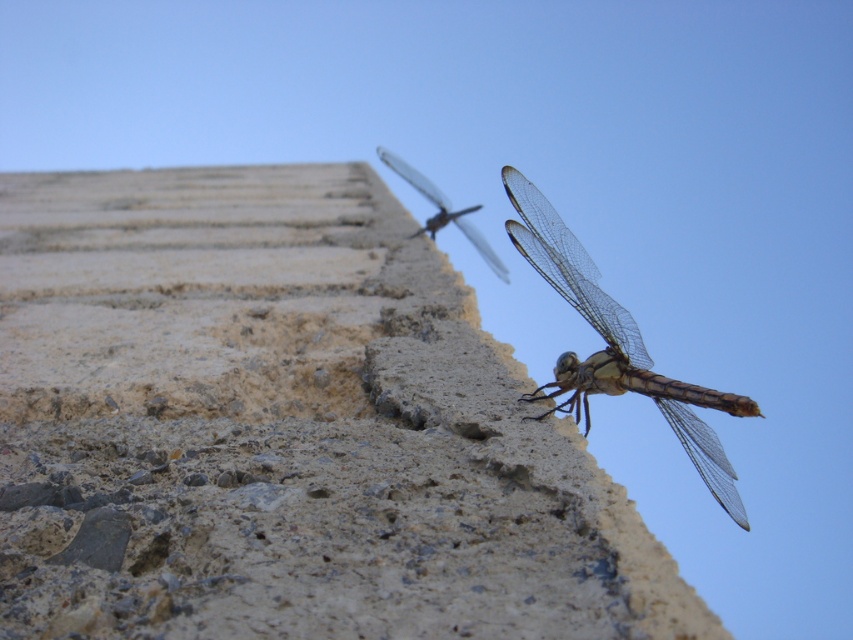
You are an entomologist examining the scene. You need to determine which object occupies more space in the image. Based on the description, which is larger in size between the rough concrete wall at center and the translucent brown dragonfly at upper right?

The rough concrete wall at center has a larger size compared to the translucent brown dragonfly at upper right, so the rough concrete wall at center occupies more space in the image.

You are a photographer trying to capture both the translucent brown dragonfly at upper right and the translucent winged insect at upper center in the same frame. Given that your camera lens has a maximum focus range of 1.2 meters, will you be able to capture both subjects clearly?

The translucent brown dragonfly at upper right and the translucent winged insect at upper center are 1.18 meters apart, so yes, the camera lens can capture both subjects clearly within its maximum focus range of 1.2 meters.